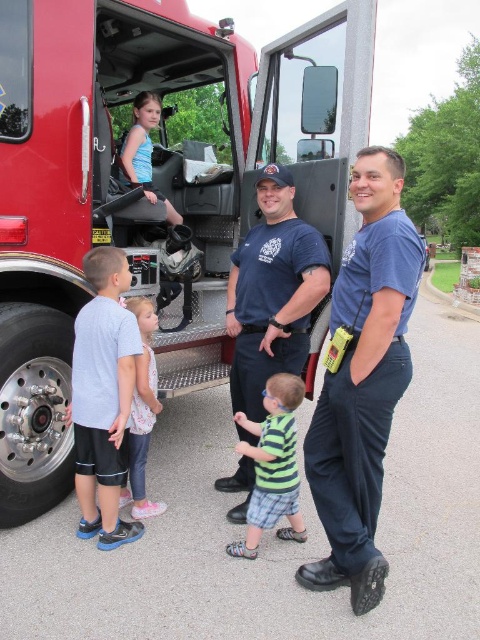
Question: Does blue cotton shirt at center appear on the left side of green striped shirt at center?

Choices:
 (A) yes
 (B) no

Answer: (A)

Question: Which of the following is the closest to the observer?

Choices:
 (A) red matte fire truck at center
 (B) pink fabric dress at lower left
 (C) green striped shirt at center

Answer: (C)

Question: Can you confirm if red matte fire truck at center is positioned above blue cotton shirt at right?

Choices:
 (A) yes
 (B) no

Answer: (A)

Question: Can you confirm if blue cotton shirt at center is positioned above gray matte shorts at lower left?

Choices:
 (A) no
 (B) yes

Answer: (B)

Question: Among these objects, which one is farthest from the camera?

Choices:
 (A) matte black helmet at upper center
 (B) pink fabric dress at lower left

Answer: (A)

Question: Which object is farther from the camera taking this photo?

Choices:
 (A) red matte fire truck at center
 (B) blue cotton shirt at center
 (C) matte black helmet at upper center

Answer: (C)